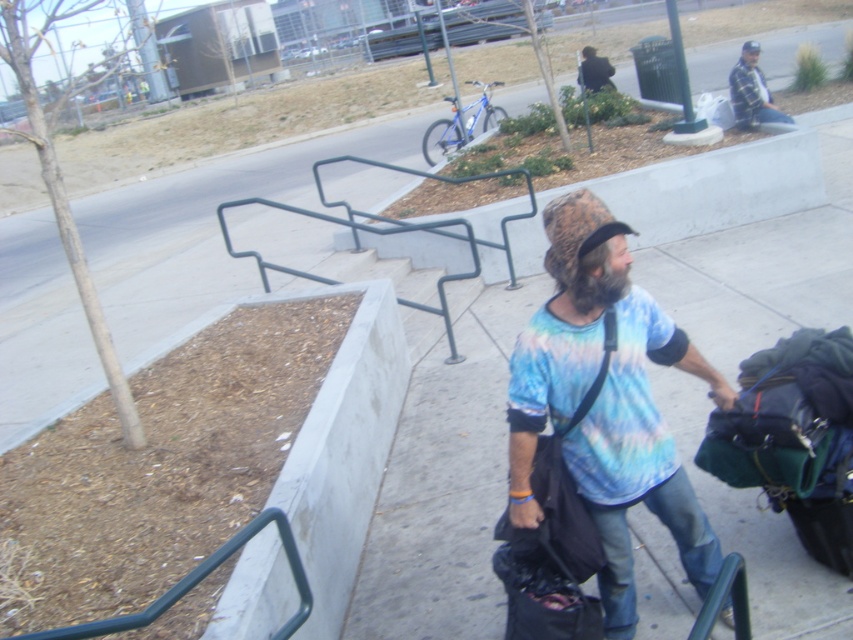
Question: Which of the following is the farthest from the observer?

Choices:
 (A) (592, 60)
 (B) (701, 554)
 (C) (750, 104)

Answer: (A)

Question: Is beardedhairman at center in front of dark blue jacket at upper center?

Choices:
 (A) yes
 (B) no

Answer: (A)

Question: Which object appears closest to the camera in this image?

Choices:
 (A) dark blue jacket at upper center
 (B) plaid flannel shirt at upper right

Answer: (B)

Question: Can you confirm if tie-dye fabric shirt at center is positioned to the right of dark blue jacket at upper center?

Choices:
 (A) no
 (B) yes

Answer: (A)

Question: Does concrete sidewalk at center appear on the right side of tie-dye fabric shirt at center?

Choices:
 (A) no
 (B) yes

Answer: (A)

Question: Which point is closer to the camera?

Choices:
 (A) (785, 116)
 (B) (610, 433)
 (C) (126, 628)
 (D) (590, 51)

Answer: (C)